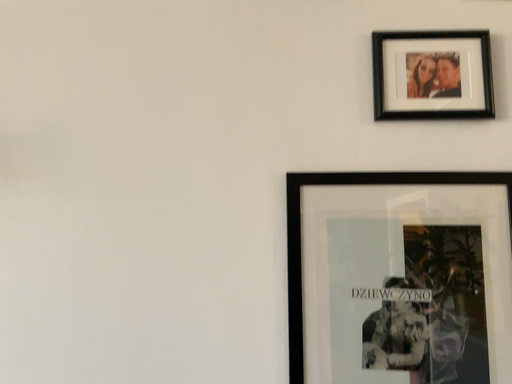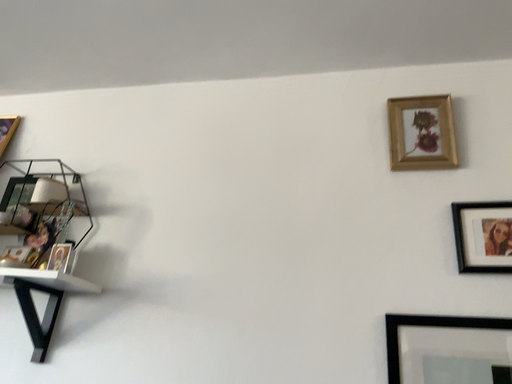
Question: Which way did the camera rotate in the video?

Choices:
 (A) rotated upward
 (B) rotated downward

Answer: (A)